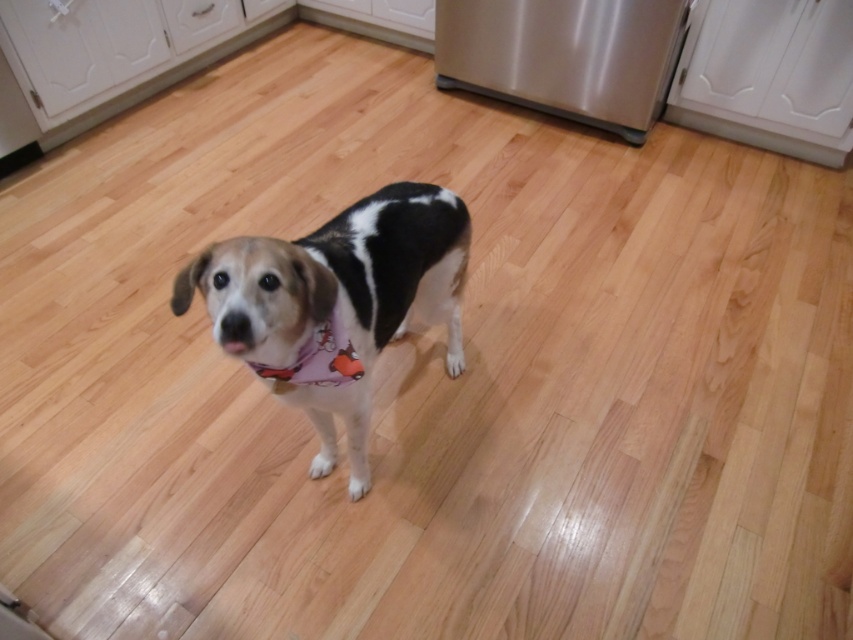
Who is shorter, white fur dog at center or stainless steel refrigerator at center?

With less height is stainless steel refrigerator at center.

Does white fur dog at center have a larger size compared to stainless steel refrigerator at center?

Actually, white fur dog at center might be smaller than stainless steel refrigerator at center.

Is point (331, 314) less distant than point (637, 124)?

Yes, point (331, 314) is in front of point (637, 124).

Identify the location of white fur dog at center. This screenshot has width=853, height=640. (335, 304).

Is white fur dog at center above purple fabric neckband at center?

Yes.

Can you confirm if white fur dog at center is positioned below purple fabric neckband at center?

No, white fur dog at center is not below purple fabric neckband at center.

Where is `white fur dog at center`? white fur dog at center is located at coordinates (335, 304).

Consider the image. Between stainless steel refrigerator at center and purple fabric neckband at center, which one has more height?

Standing taller between the two is stainless steel refrigerator at center.

Is point (631, 138) closer to viewer compared to point (321, 381)?

No, it is behind (321, 381).

This screenshot has width=853, height=640. Identify the location of stainless steel refrigerator at center. (564, 54).